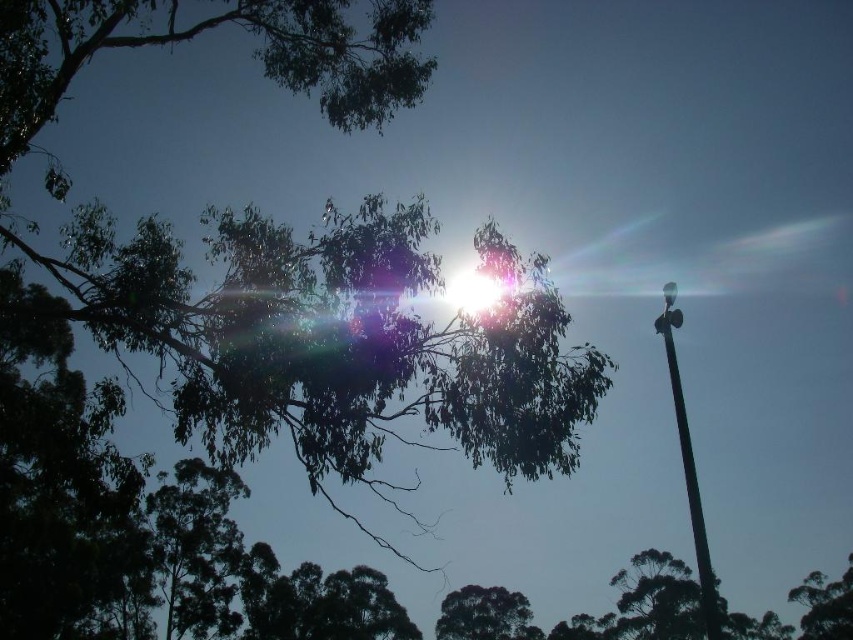
You are standing in the scene and want to locate the point at coordinates [485,614]. According to the image, what object is at that location?

The point at coordinates [485,614] corresponds to the dark green leafy tree at lower center.

You are a hiker who wants to take a photo of the dark green leafy tree at lower center and the green leafy tree at upper center. You have a camera with a 50mm lens. Can you fit both trees in the frame from your current position? Explain why or why not.

The dark green leafy tree at lower center is 30.22 meters away from the green leafy tree at upper center. A 50mm lens has a field of view of approximately 46 degrees. To determine if both trees can fit, calculate the distance between them relative to the lens. Since the trees are 30.22 meters apart, and assuming the hiker is positioned between them, the required field of view would exceed the lens capability, making it difficult to capture both in a single frame.